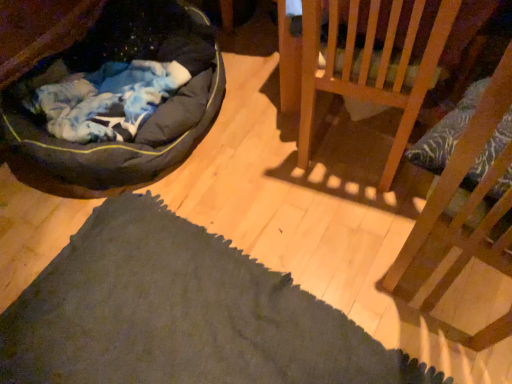
You are a GUI agent. You are given a task and a screenshot of the screen. Output one action in this format:
    pyautogui.click(x=<x>, y=<y>)
    Task: Click on the vacant space positioned to the left of wooden chair at right, acting as the 1th furniture starting from the front
    The width and height of the screenshot is (512, 384).
    Given the screenshot: What is the action you would take?
    pyautogui.click(x=347, y=254)